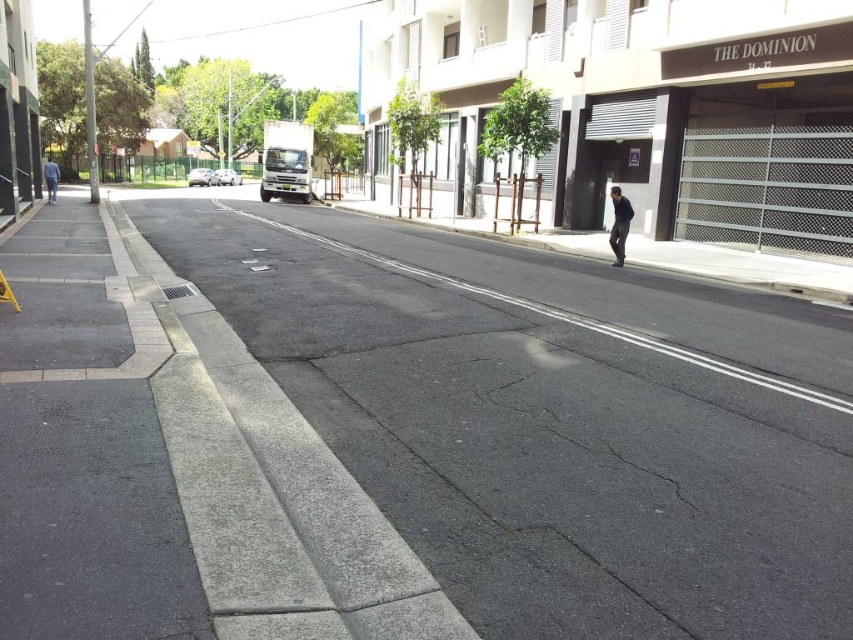
You are a delivery person trying to park your van on the gray concrete sidewalk at lower left. The van is the same size as the silver metallic sedan at center. Can you park your van there without it hanging over the edge?

The gray concrete sidewalk at lower left is bigger than the silver metallic sedan at center, so yes, the van can park there without hanging over the edge since the sidewalk is larger than the sedan.

You are a delivery person standing on the gray concrete sidewalk at lower left and need to load a package into the trunk of the silver metallic sedan at center. Can you easily access the trunk from your current position?

The gray concrete sidewalk at lower left is below the silver metallic sedan at center, so you can easily access the trunk from your current position.